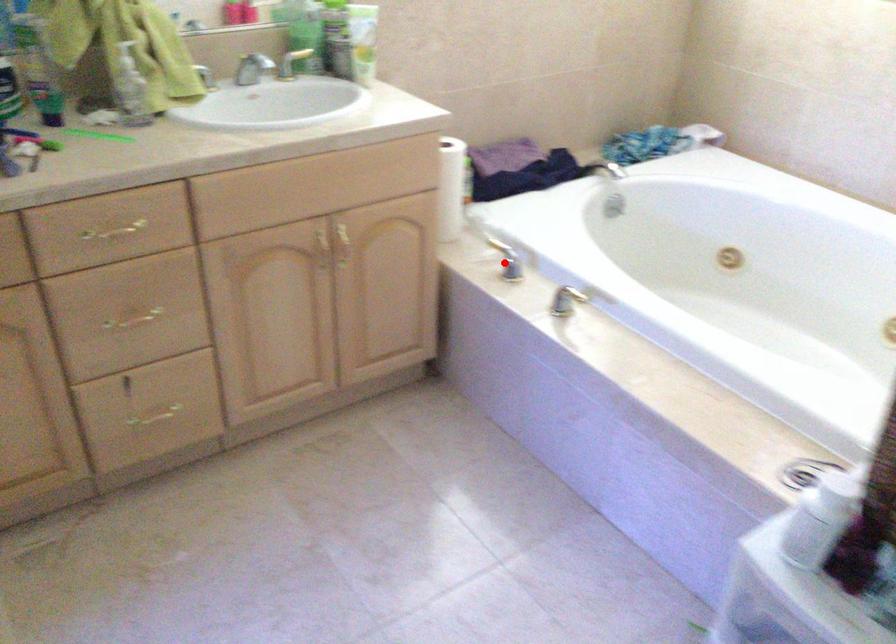
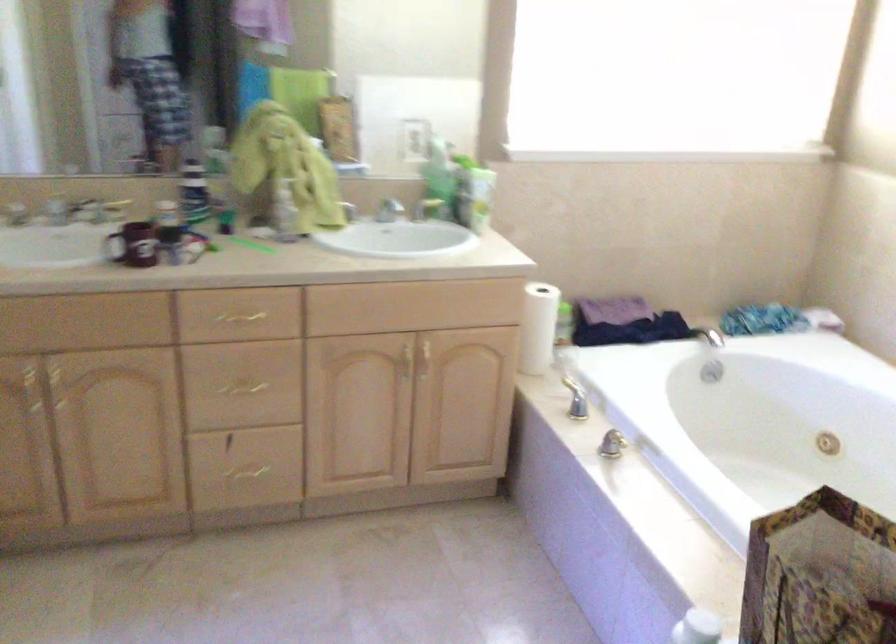
The point at the highlighted location is marked in the first image. Where is the corresponding point in the second image?

(575, 399)